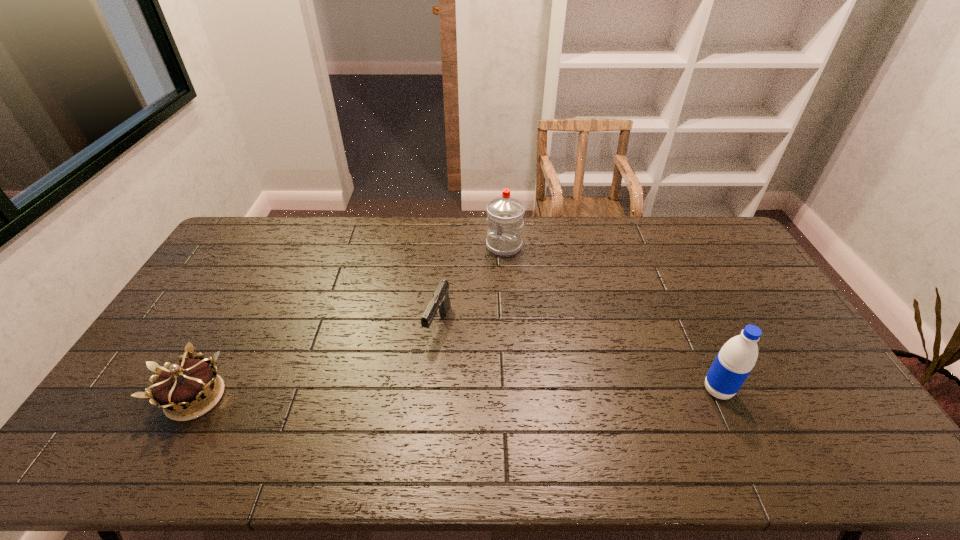
Where is `vacant space at the far edge of the desktop`? vacant space at the far edge of the desktop is located at coordinates (x=459, y=241).

At what (x,y) coordinates should I click in order to perform the action: click on vacant space at the near edge of the desktop. Please return your answer as a coordinate pair (x, y). Looking at the image, I should click on click(308, 409).

Image resolution: width=960 pixels, height=540 pixels. In the image, there is a desktop. Identify the location of vacant space at the left edge. pos(212,333).

Locate an element on the screen. This screenshot has width=960, height=540. free spot at the right edge of the desktop is located at coordinates (737, 287).

At what (x,y) coordinates should I click in order to perform the action: click on vacant space at the near left corner of the desktop. Please return your answer as a coordinate pair (x, y). Looking at the image, I should click on (133, 413).

This screenshot has height=540, width=960. Find the location of `empty space between the rightmost object and the leftmost object`. empty space between the rightmost object and the leftmost object is located at coordinates tap(457, 394).

You are a GUI agent. You are given a task and a screenshot of the screen. Output one action in this format:
    pyautogui.click(x=<x>, y=<y>)
    Task: Click on the free point between the pistol and the right water bottle
    This screenshot has width=960, height=540.
    Given the screenshot: What is the action you would take?
    pyautogui.click(x=578, y=357)

Find the location of a particular element. free point between the crown and the nearer water bottle is located at coordinates (457, 394).

Locate an element on the screen. vacant area that lies between the pistol and the second object from right to left is located at coordinates (471, 286).

Locate an element on the screen. free area in between the crown and the left water bottle is located at coordinates (349, 321).